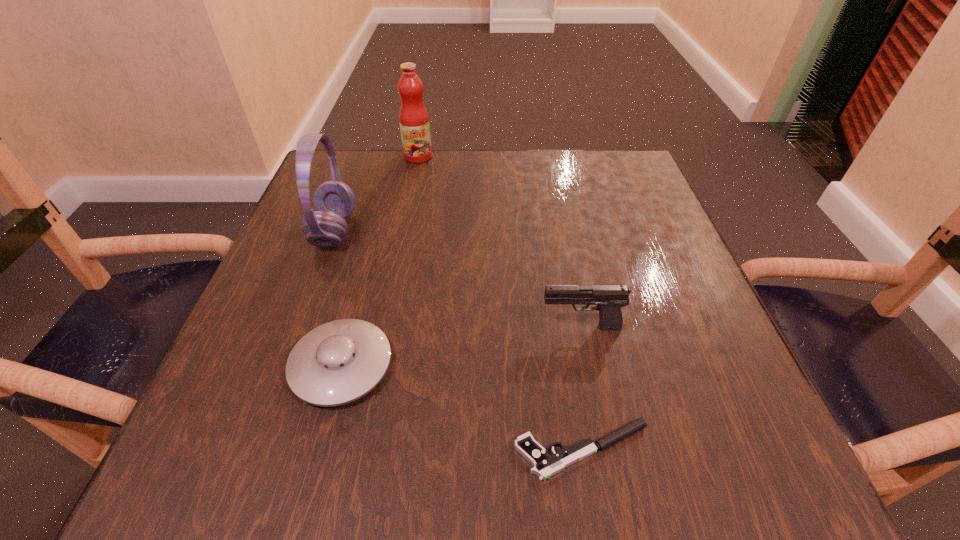
The height and width of the screenshot is (540, 960). Find the location of `object identified as the fourth closest to the fourth nearest object`. object identified as the fourth closest to the fourth nearest object is located at coordinates pos(545,466).

Identify the location of object that is the fourth closest to the nearer pistol. (414, 120).

Where is `free space that satisfies the following two spatial constraints: 1. on the front label of the fruit juice; 2. on the headband and ear cups of the headset`? free space that satisfies the following two spatial constraints: 1. on the front label of the fruit juice; 2. on the headband and ear cups of the headset is located at coordinates (404, 231).

In order to click on vacant area that satisfies the following two spatial constraints: 1. on the front label of the fruit juice; 2. on the headband and ear cups of the headset in this screenshot , I will do `click(404, 231)`.